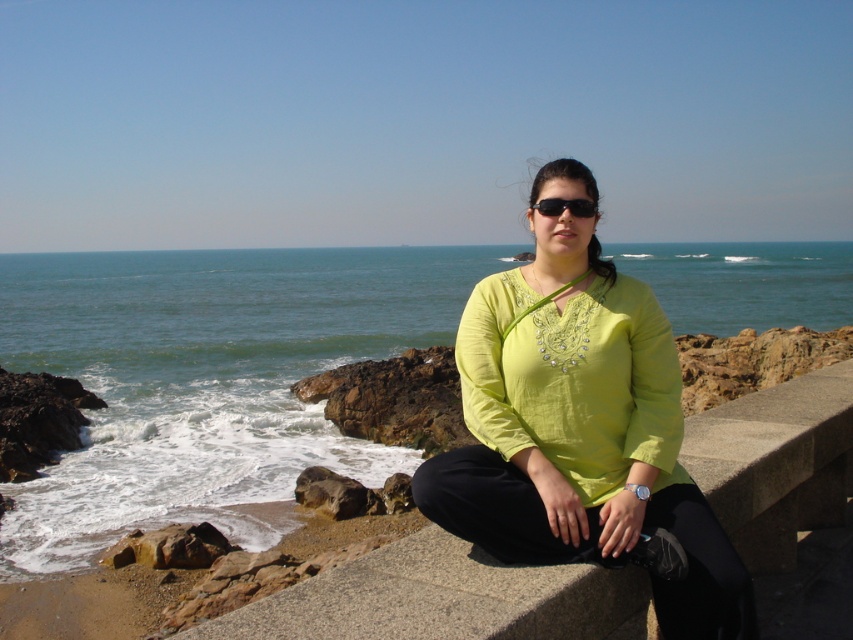
Question: Which point is closer to the camera?

Choices:
 (A) (589, 205)
 (B) (329, 324)

Answer: (A)

Question: Does blue water at center appear over black plastic sunglasses at center?

Choices:
 (A) no
 (B) yes

Answer: (B)

Question: Is blue water at center above lime green fabric at center?

Choices:
 (A) no
 (B) yes

Answer: (B)

Question: Which point is closer to the camera taking this photo?

Choices:
 (A) (581, 212)
 (B) (259, 284)

Answer: (A)

Question: Is blue water at center to the right of lime green fabric at center from the viewer's perspective?

Choices:
 (A) no
 (B) yes

Answer: (A)

Question: Which of these objects is positioned farthest from the lime green fabric at center?

Choices:
 (A) black plastic sunglasses at center
 (B) blue water at center

Answer: (B)